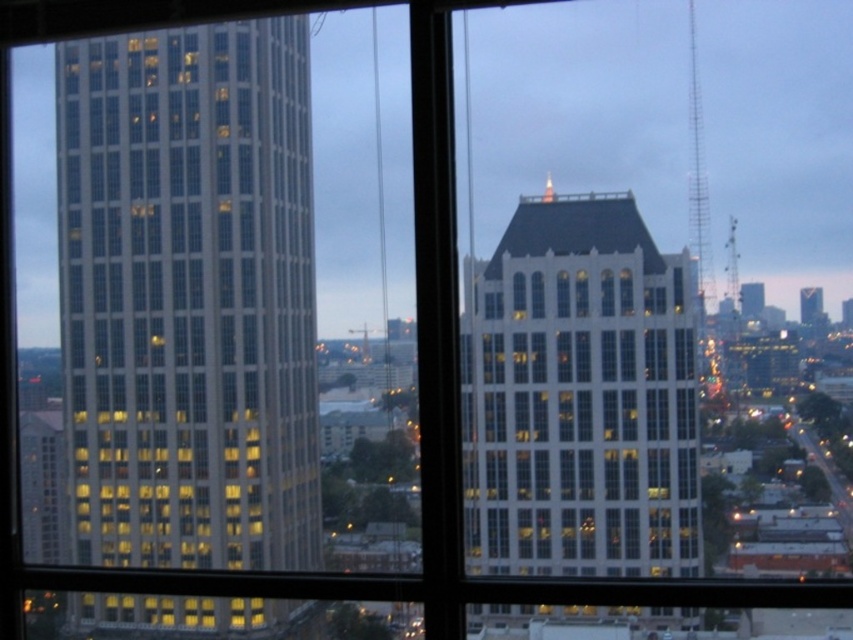
Question: Does transparent glass building at left have a lesser width compared to white glass building at center?

Choices:
 (A) yes
 (B) no

Answer: (B)

Question: Does transparent glass building at left lie in front of white glass building at center?

Choices:
 (A) yes
 (B) no

Answer: (B)

Question: Is transparent glass building at left above white glass building at center?

Choices:
 (A) no
 (B) yes

Answer: (B)

Question: Among these points, which one is farthest from the camera?

Choices:
 (A) (650, 371)
 (B) (207, 298)

Answer: (B)